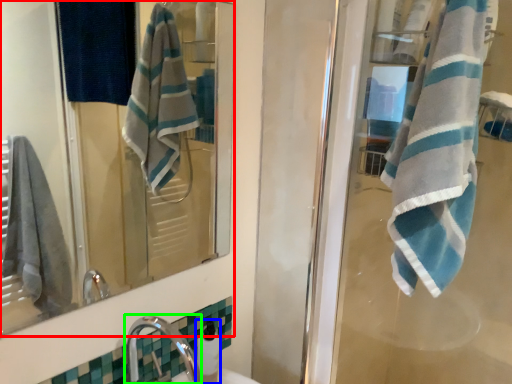
Question: Based on their relative distances, which object is farther from mirror (highlighted by a red box)? Choose from soap dispenser (highlighted by a blue box) and faucet (highlighted by a green box).

Choices:
 (A) soap dispenser
 (B) faucet

Answer: (A)